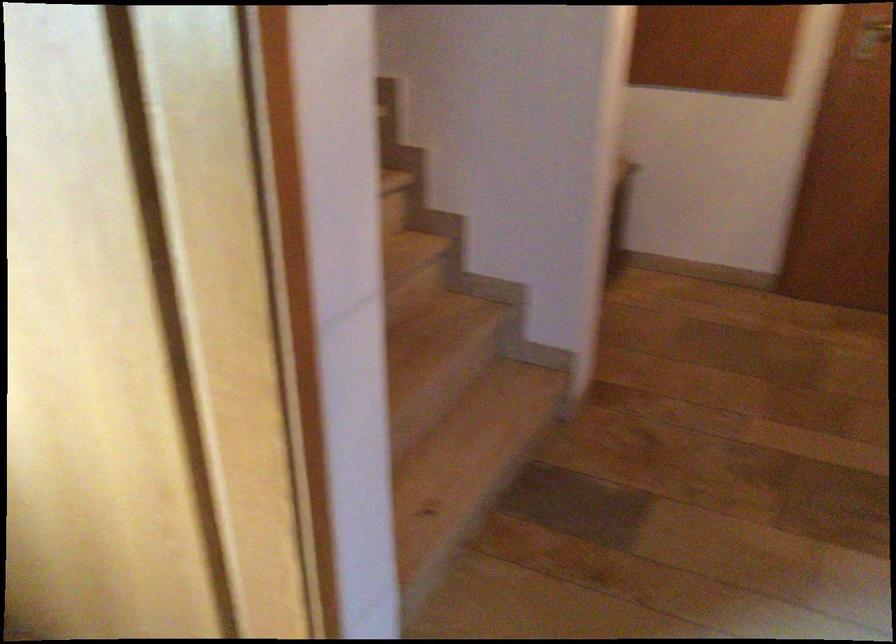
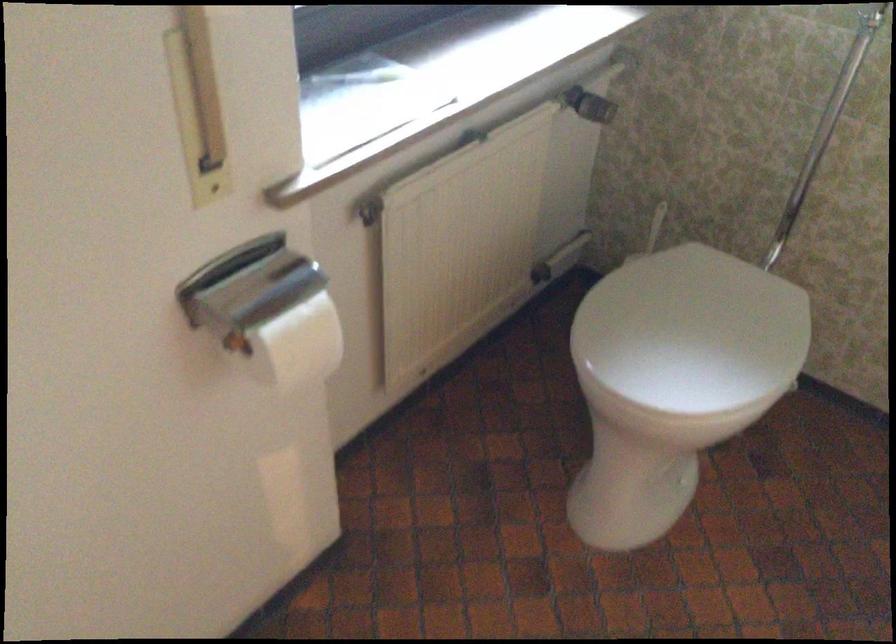
How did the camera likely rotate?

The rotation direction of the camera is left-down.